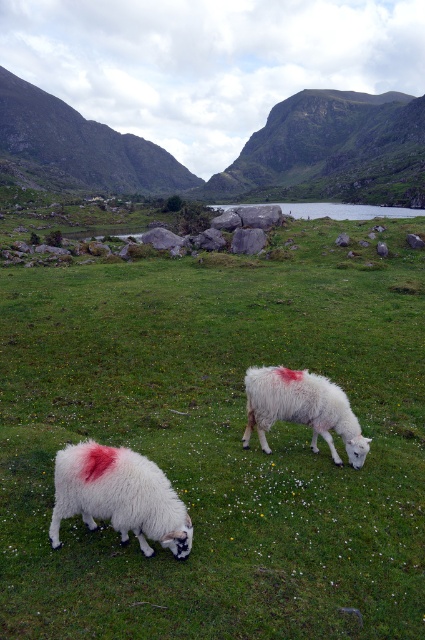
You are a drone operator tasked with capturing aerial footage of the scene. Your drone has a maximum flight range of 50 meters. If you are currently positioned above the white woolen sheep at lower left, can you fly your drone to the green smooth water at center without exceeding its range?

The white woolen sheep at lower left and green smooth water at center are 56.79 meters apart from each other. Since the drone has a maximum flight range of 50 meters, it cannot reach the green smooth water at center without exceeding its range.